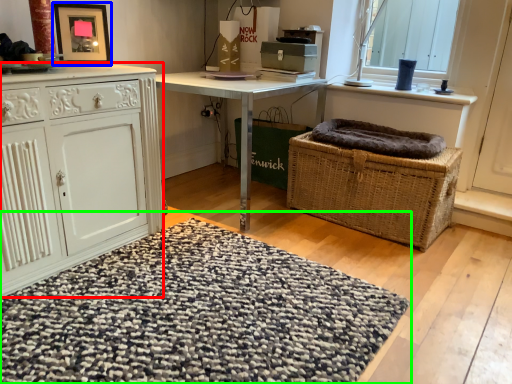
Question: Estimate the real-world distances between objects in this image. Which object is farther from cabinetry (highlighted by a red box), picture frame (highlighted by a blue box) or doormat (highlighted by a green box)?

Choices:
 (A) picture frame
 (B) doormat

Answer: (A)